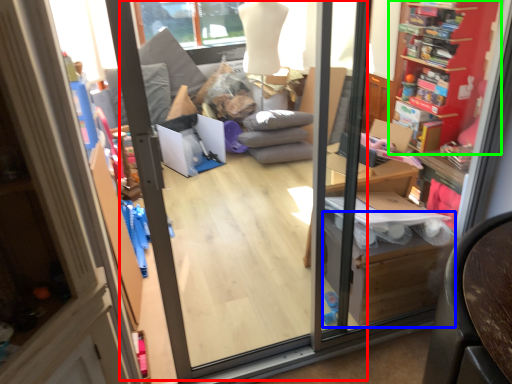
Question: Which is farther away from screen door (highlighted by a red box)? cardboard box (highlighted by a blue box) or shelf (highlighted by a green box)?

Choices:
 (A) cardboard box
 (B) shelf

Answer: (B)